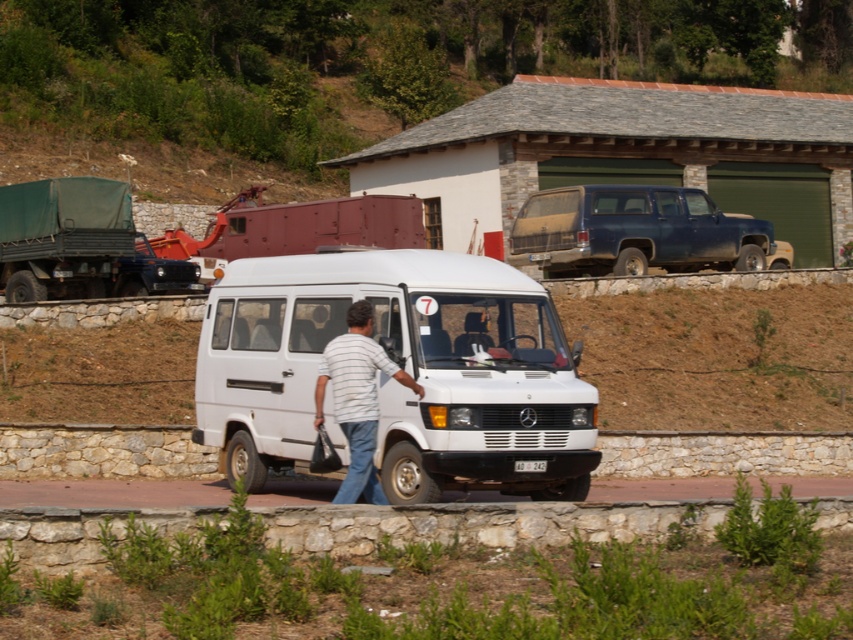
Is green canvas truck at left further to camera compared to striped fabric shirt at center?

That is True.

From the picture: Is green canvas truck at left shorter than striped fabric shirt at center?

Incorrect, green canvas truck at left's height does not fall short of striped fabric shirt at center's.

Is point (83, 284) farther from camera compared to point (363, 470)?

Yes, it is behind point (363, 470).

The height and width of the screenshot is (640, 853). I want to click on green canvas truck at left, so click(x=78, y=243).

Between white matte van at center and stone curb at lower center, which one appears on the left side from the viewer's perspective?

white matte van at center

Between white matte van at center and stone curb at lower center, which one has less height?

With less height is stone curb at lower center.

Is point (567, 454) more distant than point (61, 554)?

Yes, it is behind point (61, 554).

Where is `white matte van at center`? white matte van at center is located at coordinates (402, 368).

Does point (456, 440) come behind point (372, 374)?

Yes, point (456, 440) is farther from viewer.

Find the location of `white matte van at center`. white matte van at center is located at coordinates (402, 368).